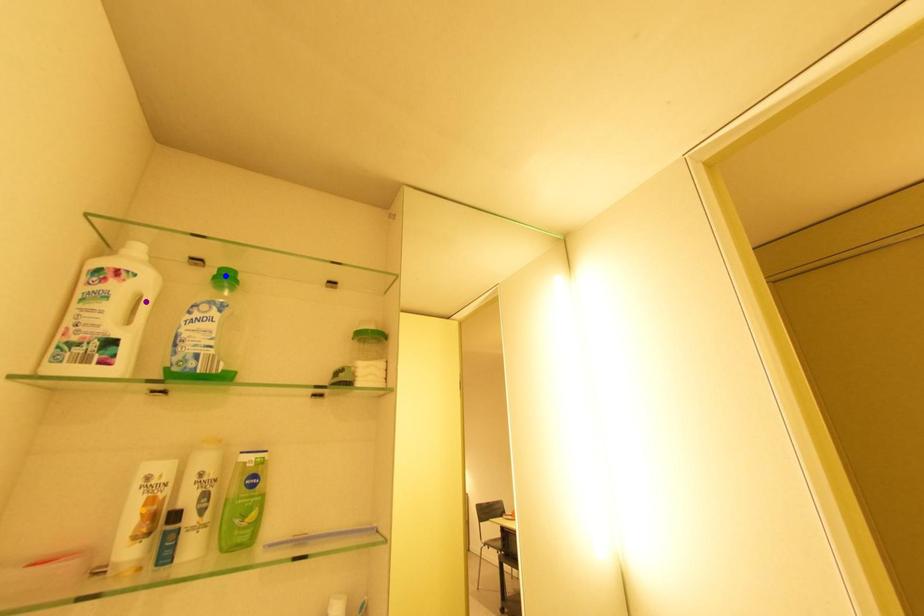
Order these from nearest to farthest:
orange point | purple point | blue point

blue point
purple point
orange point